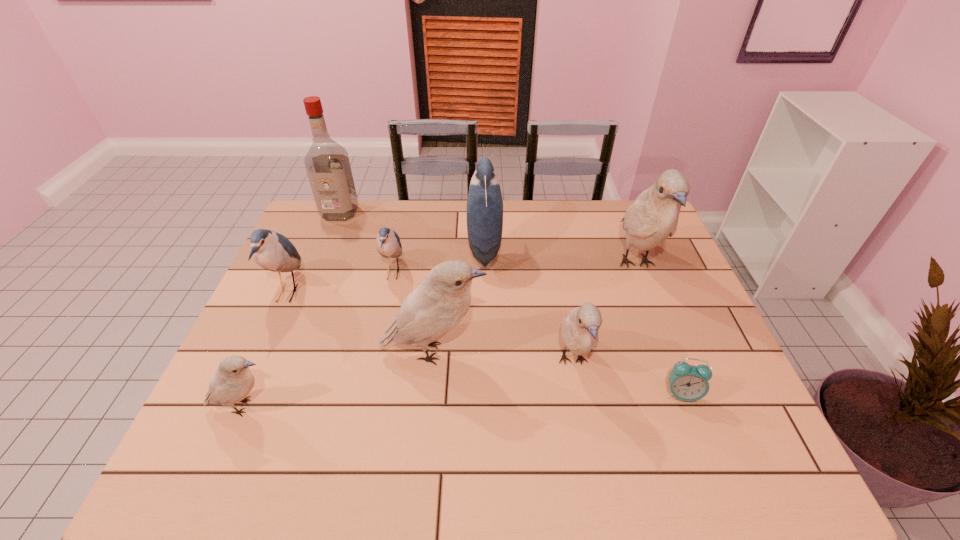
Identify the location of vacant space that satisfies the following two spatial constraints: 1. at the beak of the rightmost bird; 2. at the tip of the leftmost blue bird's beak. (647, 292).

Locate an element on the screen. Image resolution: width=960 pixels, height=540 pixels. vacant space that satisfies the following two spatial constraints: 1. at the beak of the tallest bird; 2. at the tip of the second biggest blue bird's beak is located at coordinates (647, 292).

This screenshot has width=960, height=540. I want to click on free space that satisfies the following two spatial constraints: 1. at the beak of the rightmost bird; 2. at the beak of the second biggest white bird, so click(670, 352).

Identify the location of free point that satisfies the following two spatial constraints: 1. at the beak of the rightmost bird; 2. at the beak of the third smallest white bird. [670, 352].